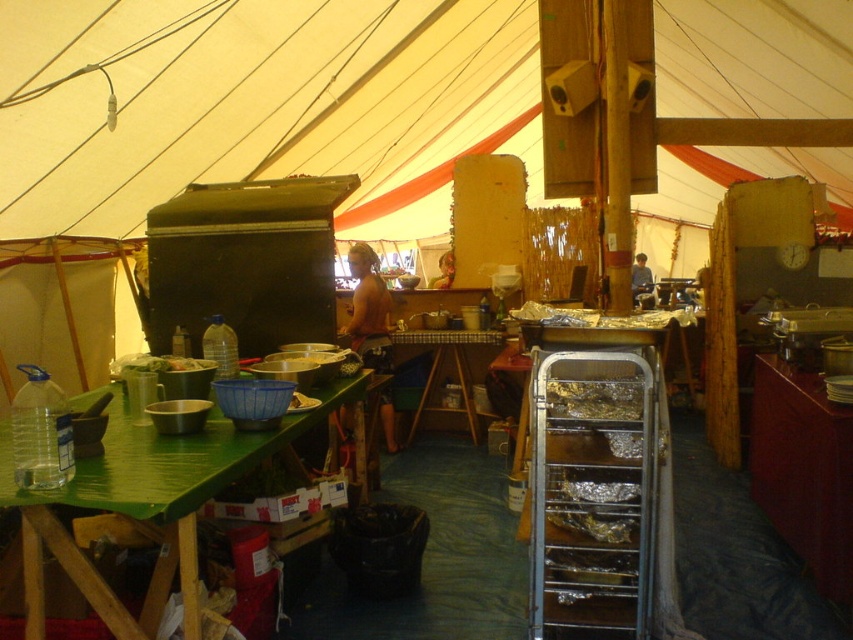
Question: Which point is closer to the camera taking this photo?

Choices:
 (A) (778, 419)
 (B) (409, 426)
 (C) (198, 444)

Answer: (C)

Question: Based on their relative distances, which object is farther from the green bamboo table at lower left?

Choices:
 (A) brown wood table at lower right
 (B) wooden table at center

Answer: (B)

Question: Which object is positioned closest to the wooden table at center?

Choices:
 (A) brown wood table at lower right
 (B) green bamboo table at lower left

Answer: (A)

Question: Does green bamboo table at lower left appear on the left side of brown wood table at lower right?

Choices:
 (A) no
 (B) yes

Answer: (B)

Question: Can you confirm if green bamboo table at lower left is bigger than brown wood table at lower right?

Choices:
 (A) no
 (B) yes

Answer: (B)

Question: Is green bamboo table at lower left positioned before brown wood table at lower right?

Choices:
 (A) no
 (B) yes

Answer: (B)